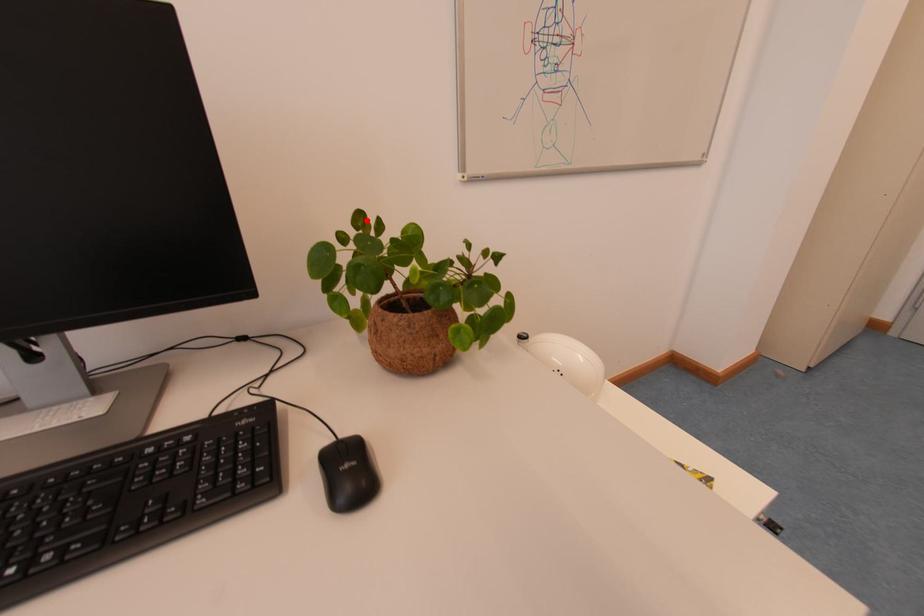
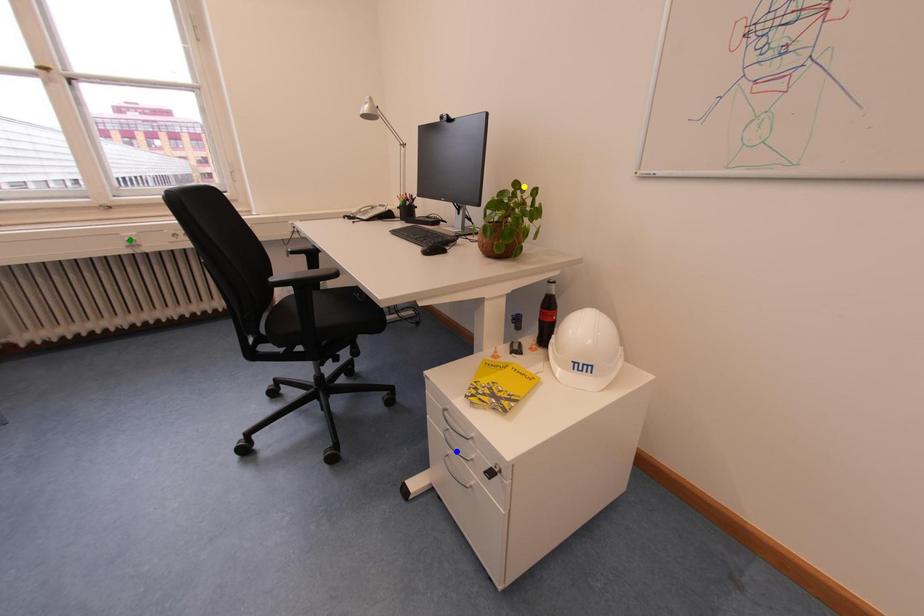
Question: I am providing you with two images of the same scene from different viewpoints. A red point is marked on the first image. You are given multiple points on the second image. Which point in image 2 is actually the same real-world point as the red point in image 1?

Choices:
 (A) green point
 (B) blue point
 (C) yellow point

Answer: (C)